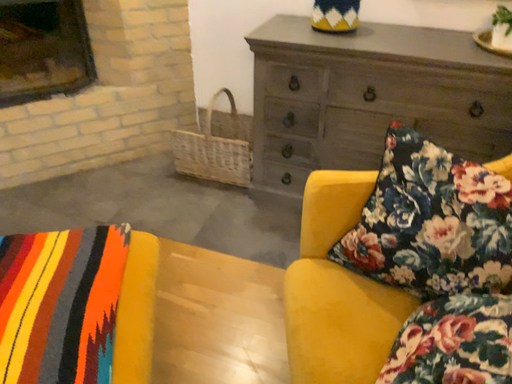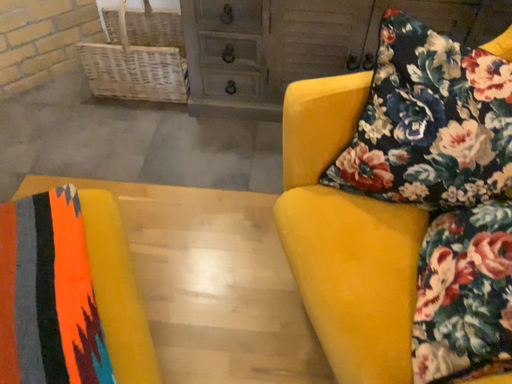
Question: Which way did the camera rotate in the video?

Choices:
 (A) rotated right
 (B) rotated left

Answer: (A)